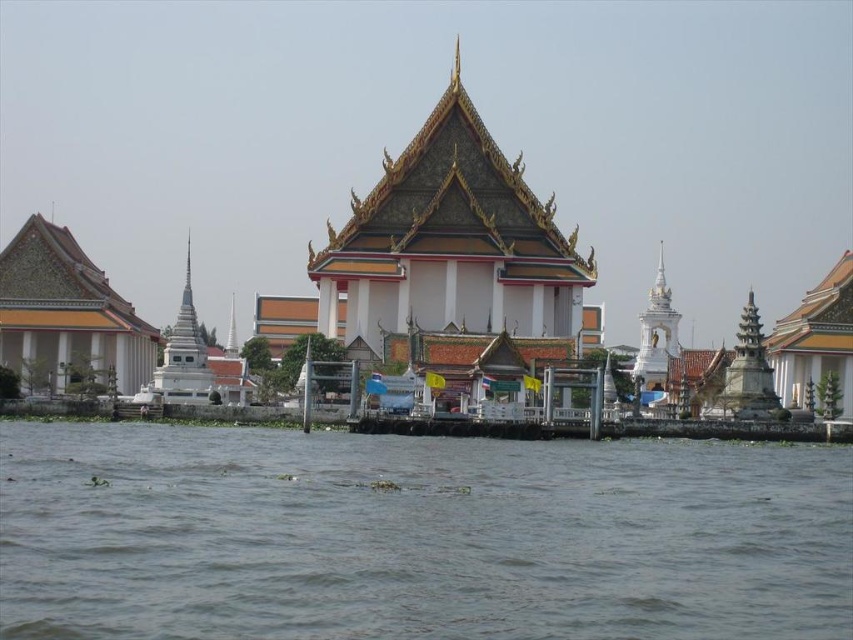
You are a tourist visiting a riverside temple. You see the white stone temple at center and the brown murky water at lower center. Which object takes up more space in the image?

The white stone temple at center is larger in size than the brown murky water at lower center, so it takes up more space in the image.

You are a tourist standing at the riverside and want to take a photo of the white stone temple at center and the brown murky water at lower center. If your camera can focus on objects up to 50 meters away, will you be able to capture both clearly in one shot?

The white stone temple at center is 55.39 meters away from the brown murky water at lower center. Since your camera can only focus up to 50 meters, you won t be able to capture both clearly in one shot because the distance between them exceeds the camera s maximum focus range.